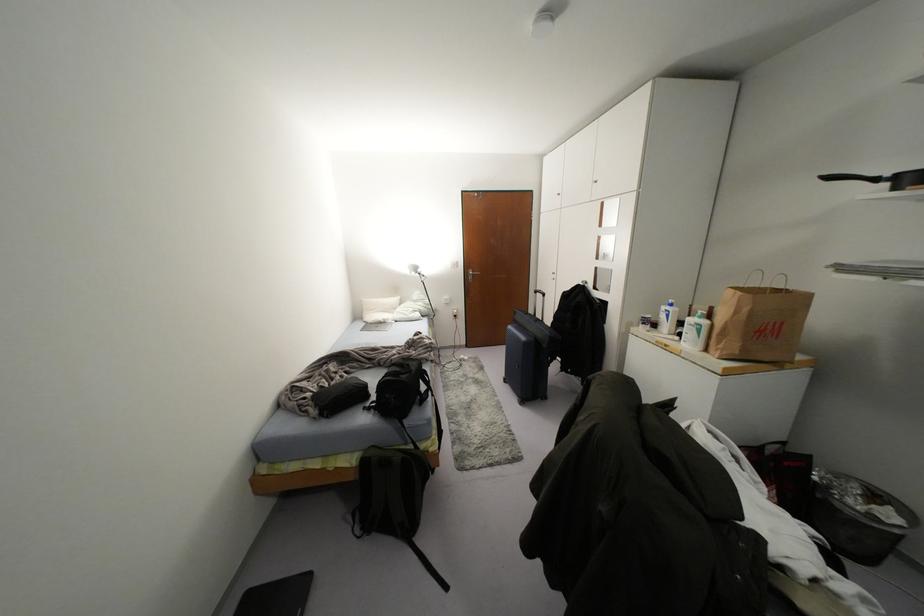
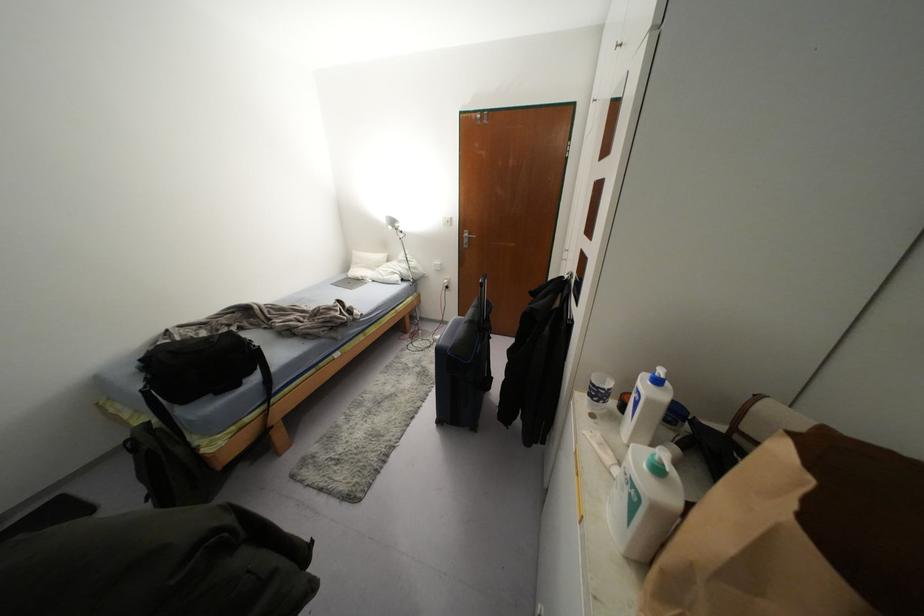
Find the pixel in the second image that matches the point at 419,270 in the first image.

(395, 225)